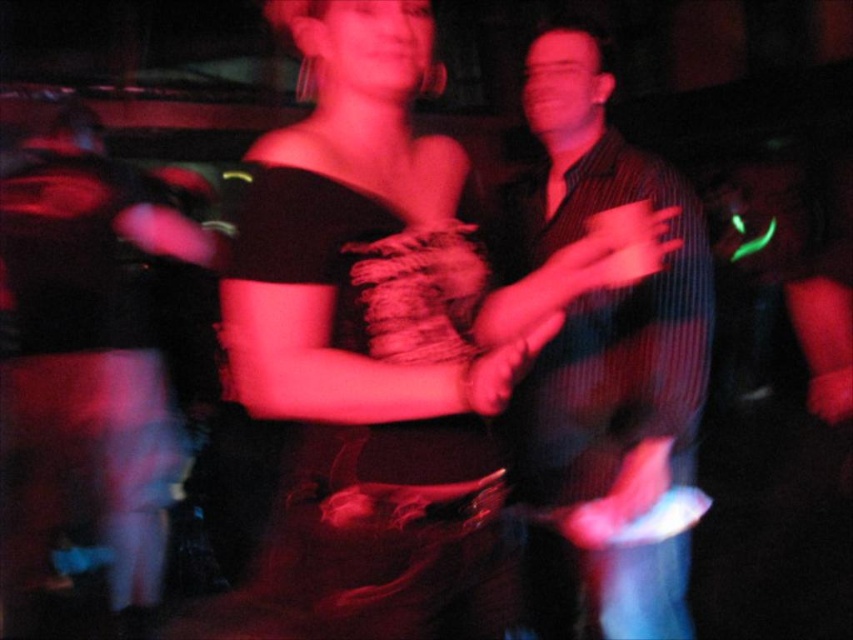
Question: Which object is positioned farthest from the striped shirt at center?

Choices:
 (A) matte black dress at center
 (B) velvet-like black dress at center

Answer: (B)

Question: Among these points, which one is farthest from the camera?

Choices:
 (A) (538, 444)
 (B) (389, 506)
 (C) (422, 428)

Answer: (A)

Question: Can you confirm if matte black dress at center is positioned above striped shirt at center?

Choices:
 (A) yes
 (B) no

Answer: (B)

Question: Is velvet-like black dress at center in front of striped shirt at center?

Choices:
 (A) no
 (B) yes

Answer: (B)

Question: Is the position of matte black dress at center less distant than that of velvet-like black dress at center?

Choices:
 (A) yes
 (B) no

Answer: (A)

Question: Which of the following is the farthest from the observer?

Choices:
 (A) (630, 589)
 (B) (421, 536)

Answer: (A)